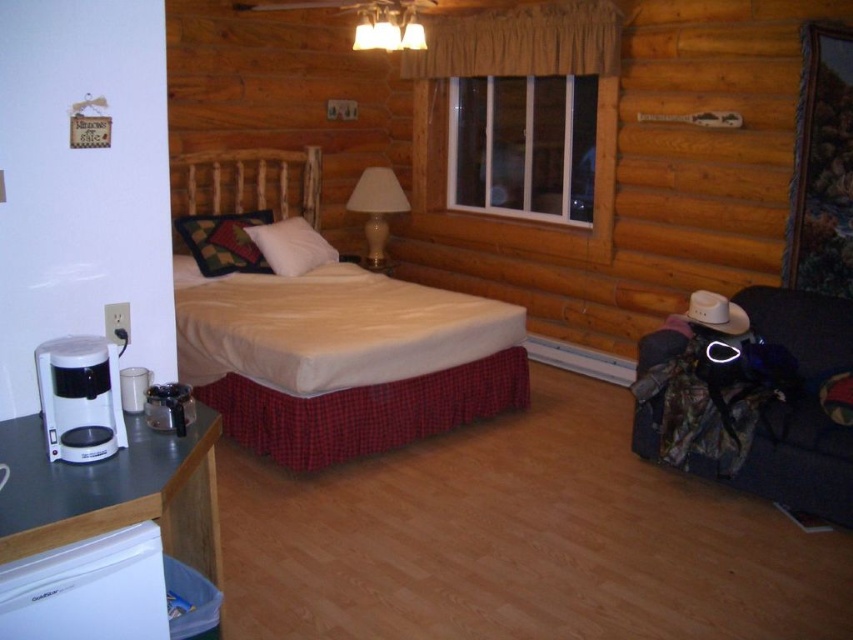
You are a guest staying in this rustic cabin bedroom and want to place your phone on a surface that is closer to you. Which object should you choose between the white plastic coffee maker at lower left and the multicolored woven pillow at center?

The white plastic coffee maker at lower left is in front of the multicolored woven pillow at center, so it is closer to you. You should place your phone on the white plastic coffee maker at lower left.

You are standing in the rustic bedroom and want to place a small decorative item between the two points labeled point (259, 340) and point (367, 236). Based on their positions, which point should the item be closer to in order to be centered between them?

The item should be closer to point (367, 236) because point (259, 340) is in front of point (367, 236), so the midpoint would be closer to the latter point.

You are organizing a small space in the bedroom and need to place the white plastic coffee maker at lower left and the multicolored woven pillow at center. Which object takes up more space?

The multicolored woven pillow at center takes up more space than the white plastic coffee maker at lower left because the white plastic coffee maker at lower left occupies less space than multicolored woven pillow at center.